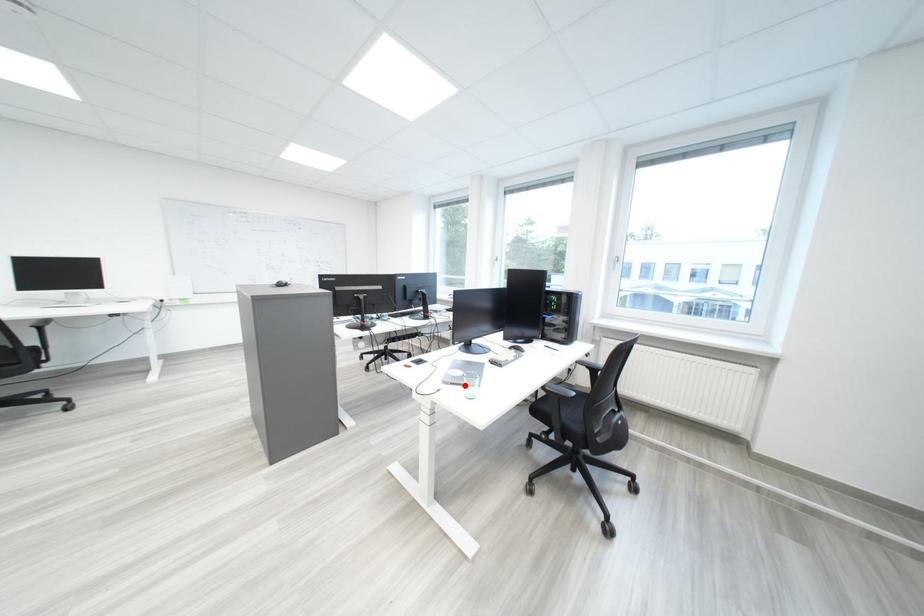
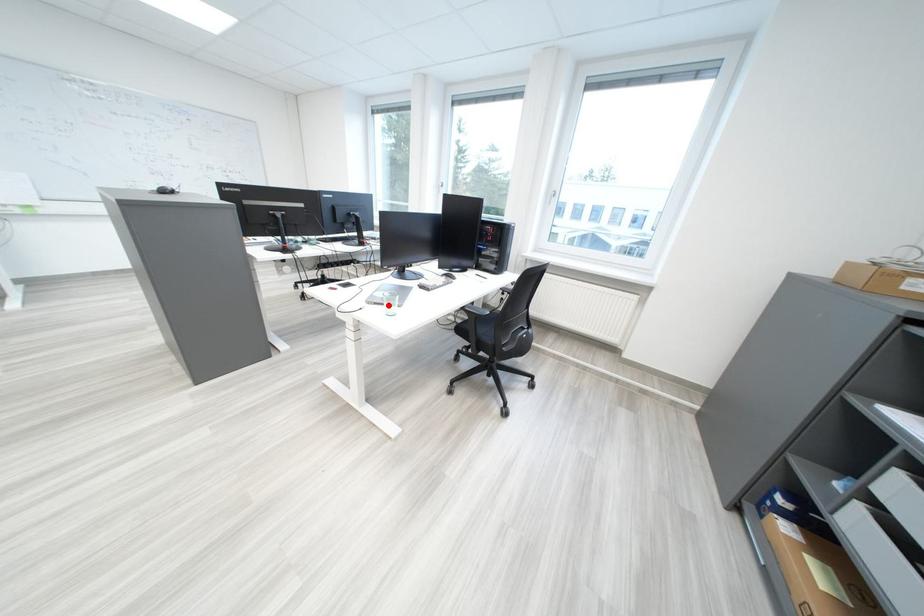
I am providing you with two images of the same scene from different viewpoints. A red point is marked on the first image and another point is marked on the second image. Do the highlighted points in image1 and image2 indicate the same real-world spot?

Yes